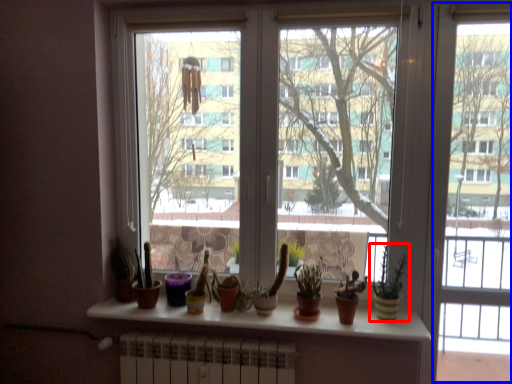
Question: Which object appears farthest to the camera in this image, houseplant (highlighted by a red box) or screen door (highlighted by a blue box)?

Choices:
 (A) houseplant
 (B) screen door

Answer: (A)